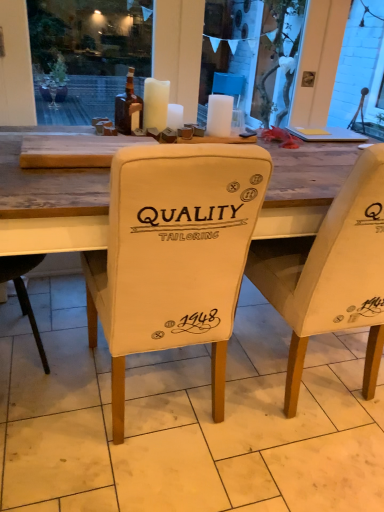
In order to click on vacant space that's between beige fabric chair at center, positioned as the second chair in left-to-right order, and beige fabric chair at center, the 1th chair positioned from the left in this screenshot , I will do `click(235, 405)`.